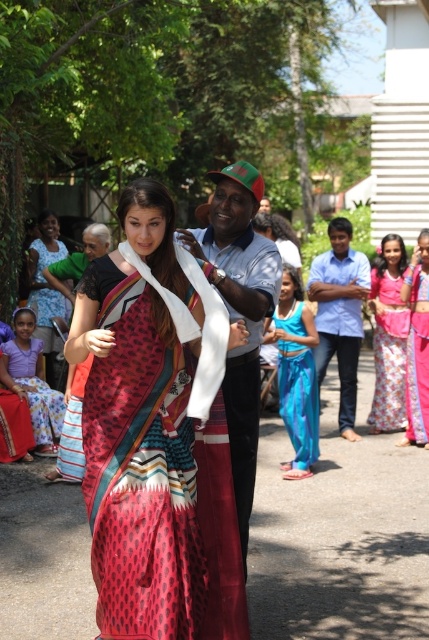
Can you confirm if floral fabric dress at center is taller than matte black saree at left?

Yes, floral fabric dress at center is taller than matte black saree at left.

Identify the location of floral fabric dress at center. This screenshot has height=640, width=429. (416, 342).

The width and height of the screenshot is (429, 640). I want to click on floral fabric dress at center, so click(416, 342).

Who is positioned more to the right, matte blue shirt at center or matte black saree at left?

Positioned to the right is matte blue shirt at center.

This screenshot has width=429, height=640. What do you see at coordinates (238, 310) in the screenshot? I see `matte blue shirt at center` at bounding box center [238, 310].

You are a GUI agent. You are given a task and a screenshot of the screen. Output one action in this format:
    pyautogui.click(x=<x>, y=<y>)
    Task: Click on the matte blue shirt at center
    The height and width of the screenshot is (640, 429).
    Given the screenshot: What is the action you would take?
    pyautogui.click(x=238, y=310)

Does matte blue shirt at center appear on the right side of purple cotton dress at lower left?

Yes, matte blue shirt at center is to the right of purple cotton dress at lower left.

Is point (238, 288) in front of point (38, 432)?

Yes, it is.

Which is behind, point (241, 243) or point (17, 358)?

Positioned behind is point (17, 358).

The height and width of the screenshot is (640, 429). I want to click on matte blue shirt at center, so click(238, 310).